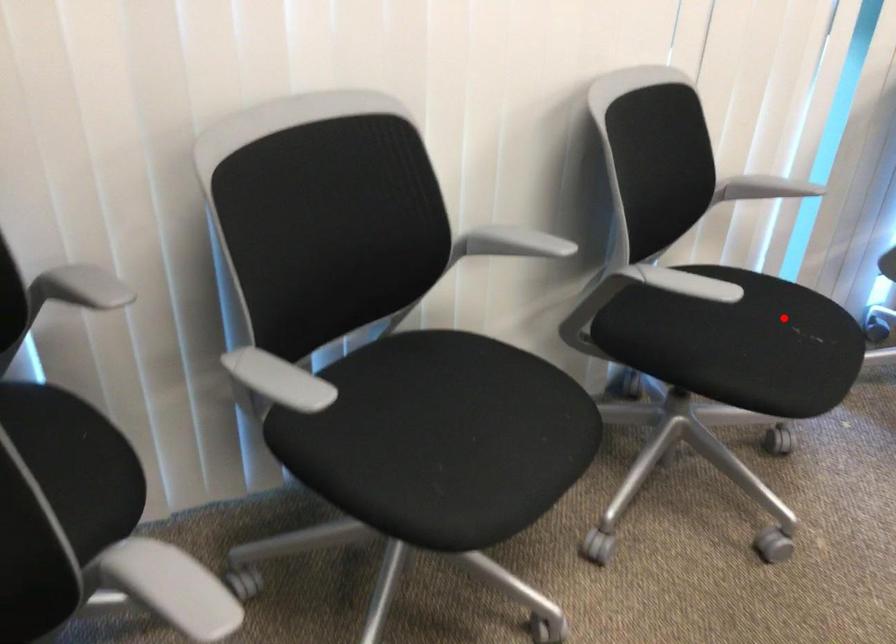
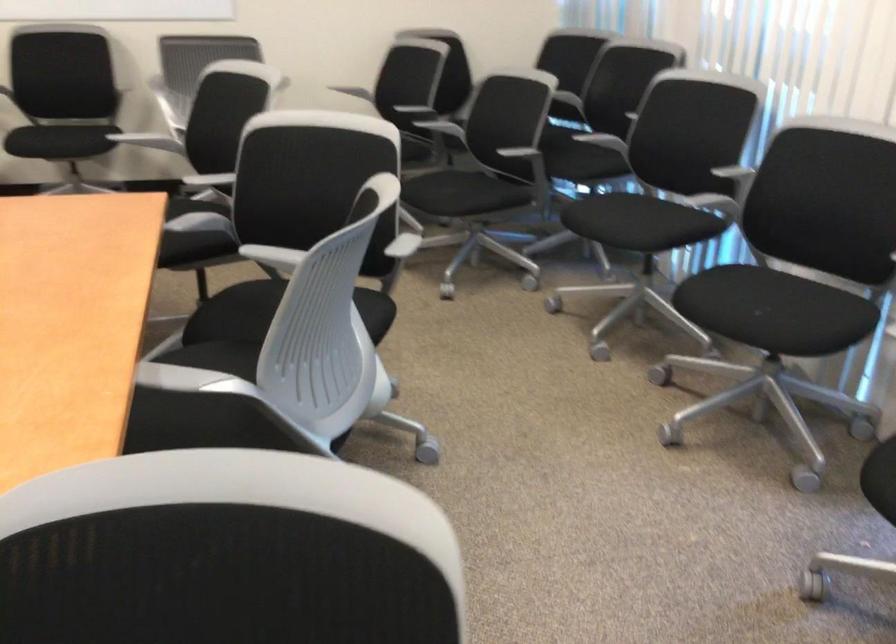
Question: A red point is marked in image1. In image2, is the corresponding 3D point closer to the camera or farther? Reply with the corresponding letter.

Choices:
 (A) The corresponding 3D point is closer.
 (B) The corresponding 3D point is farther.

Answer: (B)